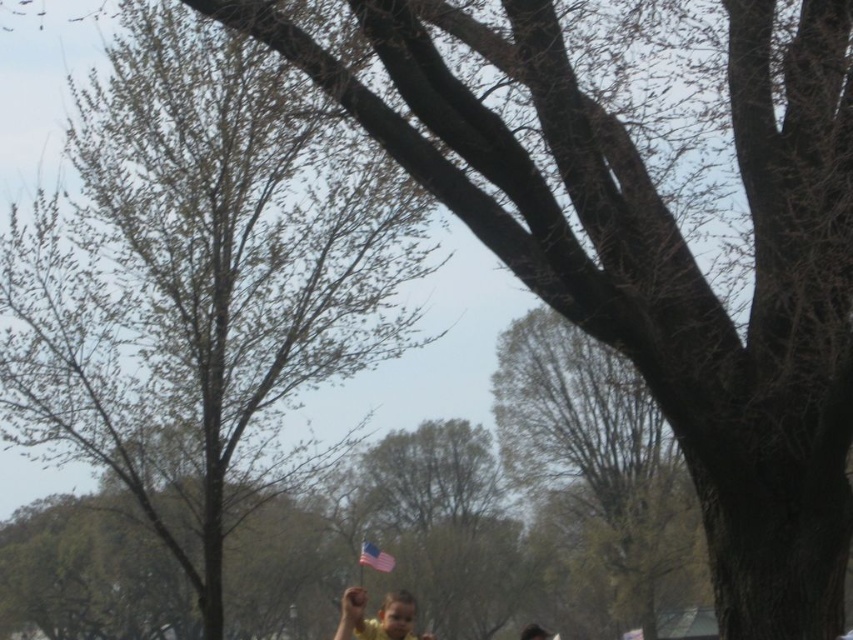
Question: Does bare branches at center have a lesser width compared to yellow matte shirt at lower center?

Choices:
 (A) no
 (B) yes

Answer: (B)

Question: Does smooth bark tree at center appear on the left side of american flag at center?

Choices:
 (A) yes
 (B) no

Answer: (B)

Question: Considering the real-world distances, which object is farthest from the smooth bark tree at center?

Choices:
 (A) yellow matte shirt at lower center
 (B) american flag at center
 (C) bare branches at center

Answer: (C)

Question: Does smooth bark tree at center come in front of yellow matte shirt at lower center?

Choices:
 (A) yes
 (B) no

Answer: (A)

Question: Among these objects, which one is nearest to the camera?

Choices:
 (A) smooth bark tree at center
 (B) bare branches at center
 (C) yellow matte shirt at lower center
 (D) american flag at center

Answer: (A)

Question: Among these objects, which one is nearest to the camera?

Choices:
 (A) american flag at center
 (B) bare branches at center
 (C) smooth bark tree at center
 (D) yellow matte shirt at lower center

Answer: (C)